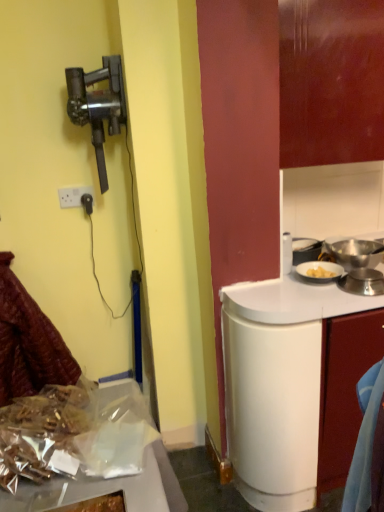
Question: From the image's perspective, would you say white plastic power outlet at upper left is positioned over leather-like maroon coat at lower left?

Choices:
 (A) no
 (B) yes

Answer: (B)

Question: Can you confirm if white plastic power outlet at upper left is wider than leather-like maroon coat at lower left?

Choices:
 (A) yes
 (B) no

Answer: (B)

Question: Can you confirm if white plastic power outlet at upper left is smaller than leather-like maroon coat at lower left?

Choices:
 (A) no
 (B) yes

Answer: (B)

Question: Is white plastic power outlet at upper left taller than leather-like maroon coat at lower left?

Choices:
 (A) no
 (B) yes

Answer: (A)

Question: Considering the relative sizes of white plastic power outlet at upper left and leather-like maroon coat at lower left in the image provided, is white plastic power outlet at upper left thinner than leather-like maroon coat at lower left?

Choices:
 (A) no
 (B) yes

Answer: (B)

Question: From the image's perspective, is white plastic power outlet at upper left under leather-like maroon coat at lower left?

Choices:
 (A) no
 (B) yes

Answer: (A)

Question: From a real-world perspective, is white glossy cabinet at right positioned over leather-like maroon coat at lower left based on gravity?

Choices:
 (A) no
 (B) yes

Answer: (B)

Question: Can you confirm if white glossy cabinet at right is wider than leather-like maroon coat at lower left?

Choices:
 (A) yes
 (B) no

Answer: (B)

Question: Is white glossy cabinet at right facing towards leather-like maroon coat at lower left?

Choices:
 (A) yes
 (B) no

Answer: (B)

Question: From a real-world perspective, is white glossy cabinet at right beneath leather-like maroon coat at lower left?

Choices:
 (A) no
 (B) yes

Answer: (A)

Question: Are white glossy cabinet at right and leather-like maroon coat at lower left located far from each other?

Choices:
 (A) no
 (B) yes

Answer: (B)

Question: Is white glossy cabinet at right not within leather-like maroon coat at lower left?

Choices:
 (A) yes
 (B) no

Answer: (A)

Question: Would you say shiny metallic foil at lower left contains metallic black vacuum cleaner at left?

Choices:
 (A) no
 (B) yes

Answer: (A)